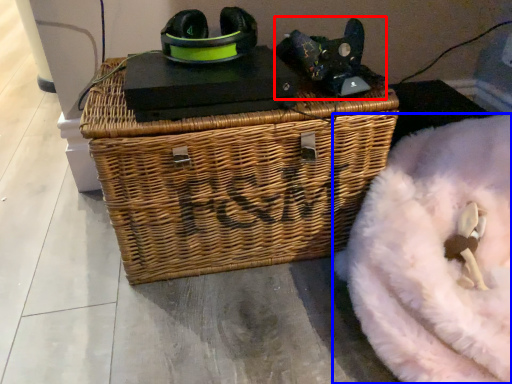
Question: Which of the following is the farthest to the observer, bean bag chair (highlighted by a red box) or bean bag chair (highlighted by a blue box)?

Choices:
 (A) bean bag chair
 (B) bean bag chair

Answer: (A)